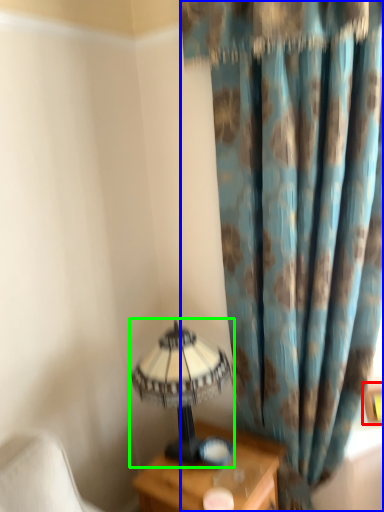
Question: Which object is positioned closest to picture frame (highlighted by a red box)? Select from curtain (highlighted by a blue box) and lamp (highlighted by a green box).

Choices:
 (A) curtain
 (B) lamp

Answer: (B)